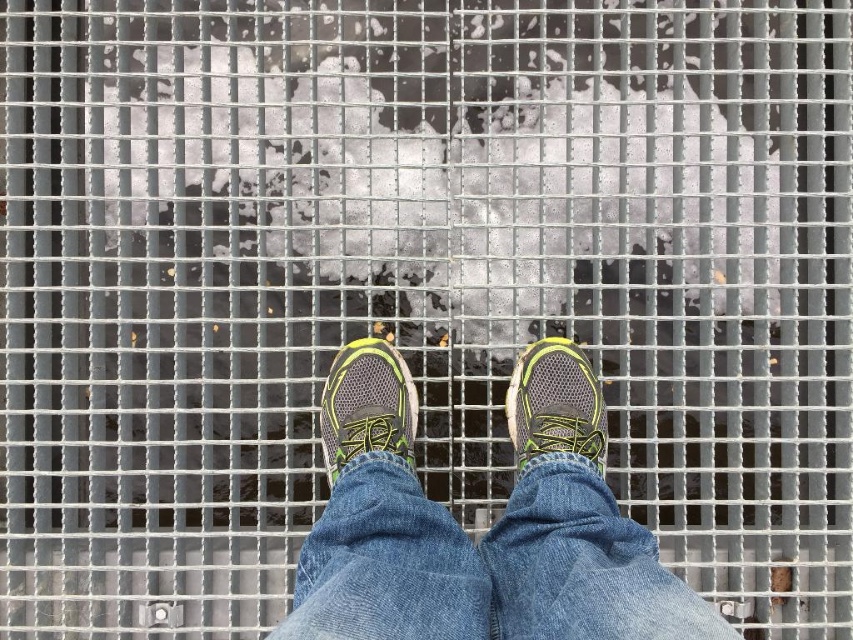
Question: Does denim at center appear on the right side of gray mesh shoe at center?

Choices:
 (A) no
 (B) yes

Answer: (A)

Question: Which point is closer to the camera taking this photo?

Choices:
 (A) (563, 380)
 (B) (355, 452)

Answer: (B)

Question: Does matte gray running shoe at center appear over gray mesh shoe at center?

Choices:
 (A) yes
 (B) no

Answer: (B)

Question: Can you confirm if matte gray running shoe at center is positioned to the left of gray mesh shoe at center?

Choices:
 (A) yes
 (B) no

Answer: (A)

Question: Among these objects, which one is nearest to the camera?

Choices:
 (A) denim at center
 (B) gray mesh shoe at center
 (C) matte gray running shoe at center

Answer: (A)

Question: Which object is the farthest from the matte gray running shoe at center?

Choices:
 (A) gray mesh shoe at center
 (B) denim at center

Answer: (A)